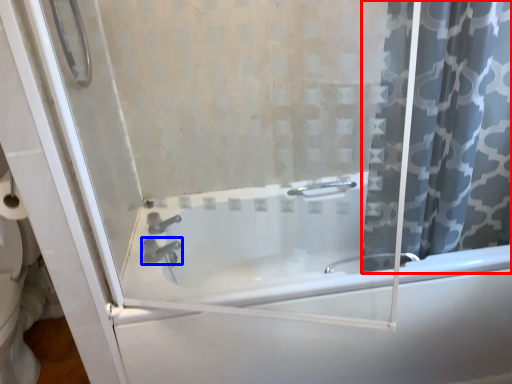
Question: Which object is further to the camera taking this photo, curtain (highlighted by a red box) or tap (highlighted by a blue box)?

Choices:
 (A) curtain
 (B) tap

Answer: (B)